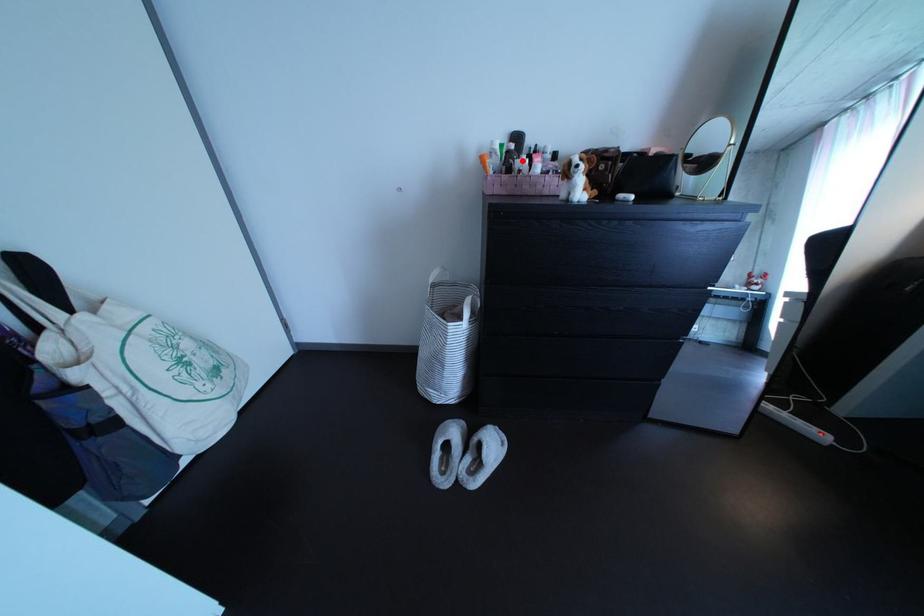
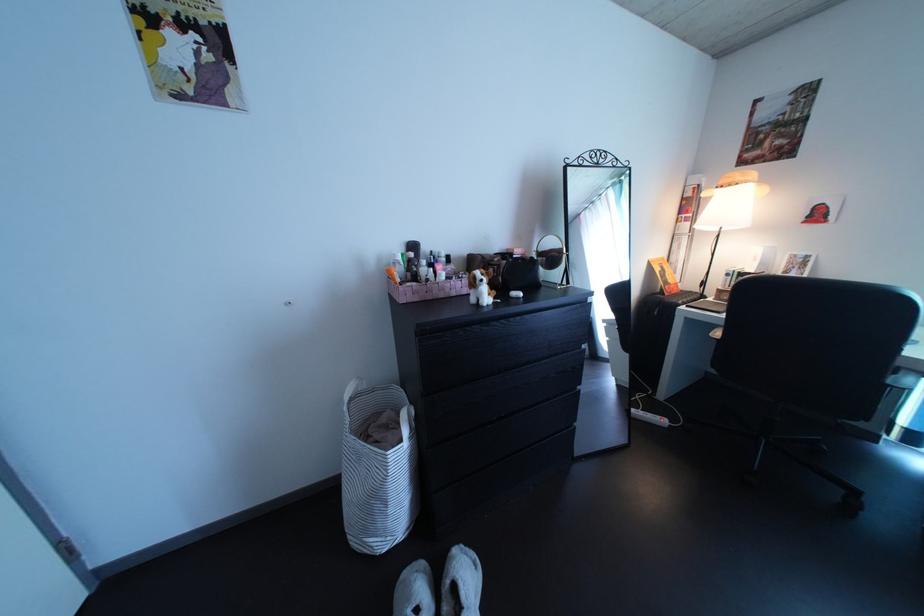
In the second image, find the point that corresponds to the highlighted location in the first image.

(424, 269)